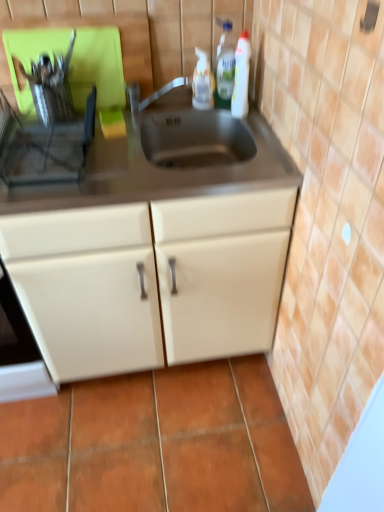
Question: Could white plastic bottle at upper right, the third bottle viewed from the left, be considered to be inside translucent plastic bottle at upper right, marked as the second bottle in a right-to-left arrangement?

Choices:
 (A) yes
 (B) no

Answer: (B)

Question: Would you say translucent plastic bottle at upper right, marked as the 2th bottle in a left-to-right arrangement, is a long distance from white plastic bottle at upper right, which ranks as the 1th bottle in right-to-left order?

Choices:
 (A) yes
 (B) no

Answer: (B)

Question: From the image's perspective, is translucent plastic bottle at upper right, marked as the second bottle in a right-to-left arrangement, below white plastic bottle at upper right, which ranks as the 1th bottle in right-to-left order?

Choices:
 (A) yes
 (B) no

Answer: (B)

Question: Is translucent plastic bottle at upper right, marked as the second bottle in a right-to-left arrangement, aimed at white plastic bottle at upper right, which ranks as the 1th bottle in right-to-left order?

Choices:
 (A) yes
 (B) no

Answer: (A)

Question: Is translucent plastic bottle at upper right, marked as the second bottle in a right-to-left arrangement, closer to camera compared to white plastic bottle at upper right, which ranks as the 1th bottle in right-to-left order?

Choices:
 (A) yes
 (B) no

Answer: (B)

Question: In the image, is translucent plastic spray bottle at upper center, the first bottle viewed from the left, on the left side or the right side of white plastic bottle at upper right, which ranks as the 1th bottle in right-to-left order?

Choices:
 (A) right
 (B) left

Answer: (B)

Question: In the image, is translucent plastic spray bottle at upper center, the first bottle viewed from the left, positioned in front of or behind white plastic bottle at upper right, which ranks as the 1th bottle in right-to-left order?

Choices:
 (A) front
 (B) behind

Answer: (B)

Question: Is translucent plastic spray bottle at upper center, the first bottle viewed from the left, taller or shorter than white plastic bottle at upper right, the third bottle viewed from the left?

Choices:
 (A) tall
 (B) short

Answer: (B)

Question: Considering the positions of translucent plastic spray bottle at upper center, the 3th bottle from the right, and white plastic bottle at upper right, which ranks as the 1th bottle in right-to-left order, in the image, is translucent plastic spray bottle at upper center, the 3th bottle from the right, wider or thinner than white plastic bottle at upper right, which ranks as the 1th bottle in right-to-left order,?

Choices:
 (A) thin
 (B) wide

Answer: (A)

Question: In the image, is satin nickel faucet at center on the left side or the right side of translucent plastic spray bottle at upper center, the first bottle viewed from the left?

Choices:
 (A) right
 (B) left

Answer: (B)

Question: Considering the positions of satin nickel faucet at center and translucent plastic spray bottle at upper center, the first bottle viewed from the left, in the image, is satin nickel faucet at center wider or thinner than translucent plastic spray bottle at upper center, the first bottle viewed from the left,?

Choices:
 (A) wide
 (B) thin

Answer: (B)

Question: From the image's perspective, relative to translucent plastic spray bottle at upper center, the first bottle viewed from the left, is satin nickel faucet at center above or below?

Choices:
 (A) below
 (B) above

Answer: (A)

Question: Is point (147, 104) positioned closer to the camera than point (200, 89)?

Choices:
 (A) farther
 (B) closer

Answer: (B)

Question: In the image, is white plastic bottle at upper right, the third bottle viewed from the left, positioned in front of or behind satin nickel faucet at center?

Choices:
 (A) behind
 (B) front

Answer: (B)

Question: Considering the positions of point pyautogui.click(x=248, y=34) and point pyautogui.click(x=125, y=89), is point pyautogui.click(x=248, y=34) closer or farther from the camera than point pyautogui.click(x=125, y=89)?

Choices:
 (A) farther
 (B) closer

Answer: (B)